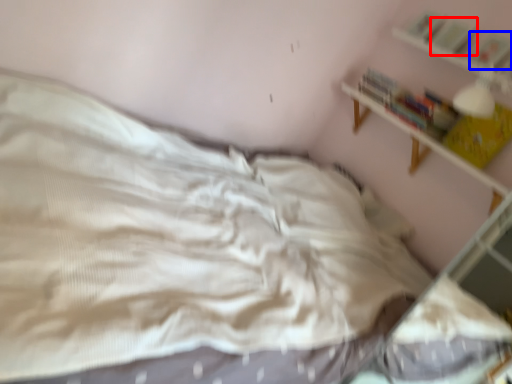
Question: Which point is further to the camera, book (highlighted by a red box) or book (highlighted by a blue box)?

Choices:
 (A) book
 (B) book

Answer: (A)